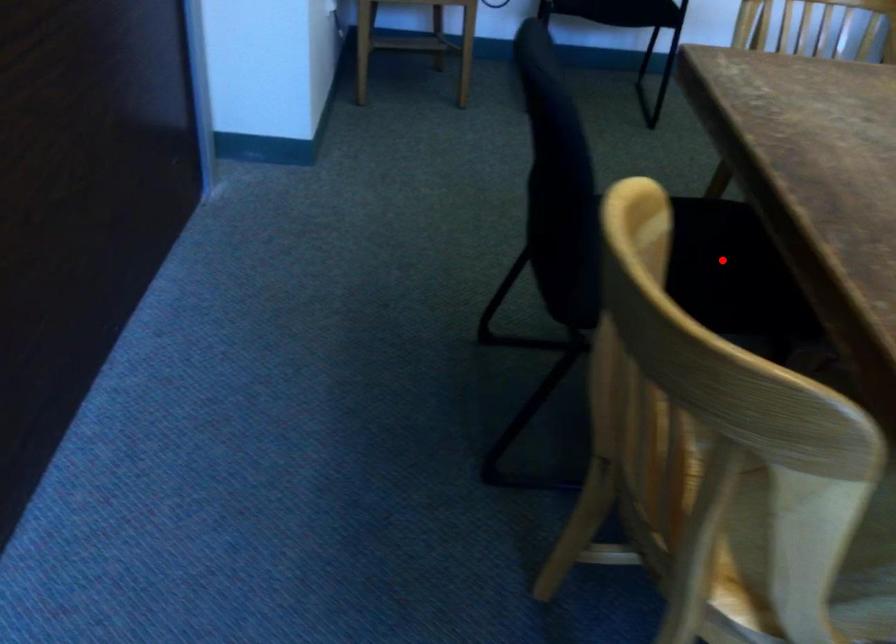
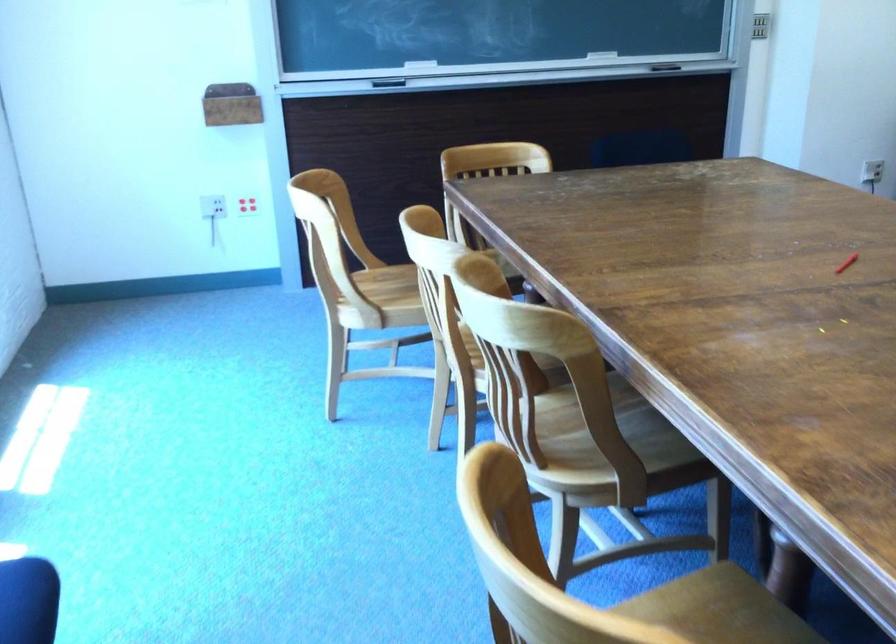
Question: I am providing you with two images of the same scene from different viewpoints. A red point is marked on the first image. Can you still see the location of the red point in image 2?

Choices:
 (A) Yes
 (B) No

Answer: (B)